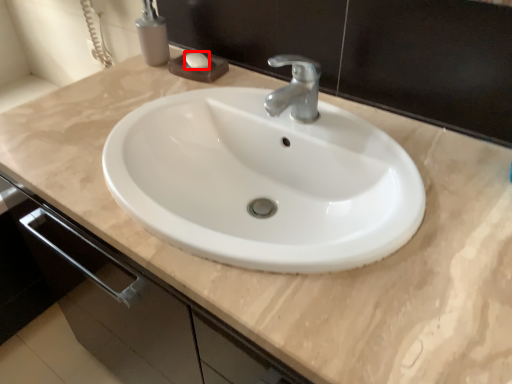
Question: Where is soap (annotated by the red box) located in relation to soap dispenser in the image?

Choices:
 (A) right
 (B) left

Answer: (A)